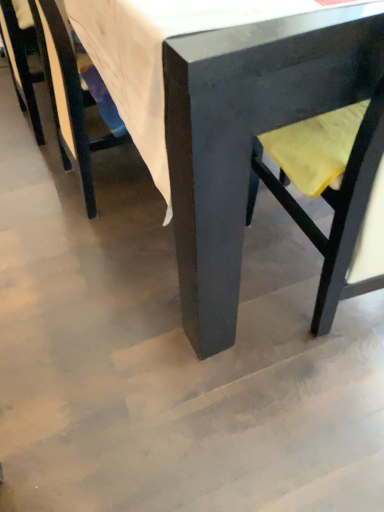
Image resolution: width=384 pixels, height=512 pixels. What do you see at coordinates (336, 195) in the screenshot? I see `yellow fabric swivel chair at right` at bounding box center [336, 195].

What do you see at coordinates (68, 97) in the screenshot?
I see `matte black chair at lower left, which is the second chair from right to left` at bounding box center [68, 97].

Where is `matte black chair at left, the 3th chair when ordered from right to left`? This screenshot has width=384, height=512. matte black chair at left, the 3th chair when ordered from right to left is located at coordinates (20, 67).

I want to click on yellow fabric swivel chair at right, so click(336, 195).

Looking at this image, is matte black chair at left, positioned as the first chair in left-to-right order, behind matte black chair at center, which is counted as the 3th chair, starting from the left?

That is True.

How different are the orientations of matte black chair at left, positioned as the first chair in left-to-right order, and matte black chair at center, which is counted as the 3th chair, starting from the left, in degrees?

They differ by 0.467 degrees in their facing directions.

In the scene shown: Can you confirm if matte black chair at left, positioned as the first chair in left-to-right order, is bigger than matte black chair at center, the 1th chair positioned from the right?

No, matte black chair at left, positioned as the first chair in left-to-right order, is not bigger than matte black chair at center, the 1th chair positioned from the right.

Are matte black chair at left, positioned as the first chair in left-to-right order, and matte black chair at center, the 1th chair positioned from the right, located far from each other?

Indeed, matte black chair at left, positioned as the first chair in left-to-right order, is not near matte black chair at center, the 1th chair positioned from the right.

In the image, there is a matte black chair at left, positioned as the first chair in left-to-right order. Identify the location of chair below it (from the image's perspective). This screenshot has width=384, height=512. click(68, 97).

Which object is thinner, matte black chair at left, the 3th chair when ordered from right to left, or matte black chair at lower left, which is the second chair in left-to-right order?

matte black chair at left, the 3th chair when ordered from right to left, is thinner.

Would you say matte black chair at left, the 3th chair when ordered from right to left, is a long distance from matte black chair at lower left, which is the second chair in left-to-right order?

No.

Are matte black chair at lower left, which is the second chair in left-to-right order, and matte black chair at left, the 3th chair when ordered from right to left, making contact?

matte black chair at lower left, which is the second chair in left-to-right order, is not next to matte black chair at left, the 3th chair when ordered from right to left, and they're not touching.

Considering the relative sizes of matte black chair at lower left, which is the second chair from right to left, and matte black chair at left, positioned as the first chair in left-to-right order, in the image provided, is matte black chair at lower left, which is the second chair from right to left, thinner than matte black chair at left, positioned as the first chair in left-to-right order,?

Incorrect, the width of matte black chair at lower left, which is the second chair from right to left, is not less than that of matte black chair at left, positioned as the first chair in left-to-right order.

Is matte black chair at lower left, which is the second chair from right to left, completely or partially outside of matte black chair at left, positioned as the first chair in left-to-right order?

Yes, matte black chair at lower left, which is the second chair from right to left, is outside of matte black chair at left, positioned as the first chair in left-to-right order.

Is matte black chair at lower left, which is the second chair in left-to-right order, inside or outside of matte black chair at center, which is counted as the 3th chair, starting from the left?

matte black chair at lower left, which is the second chair in left-to-right order, is enclosed within matte black chair at center, which is counted as the 3th chair, starting from the left.

Is matte black chair at lower left, which is the second chair from right to left, looking in the opposite direction of matte black chair at center, which is counted as the 3th chair, starting from the left?

Absolutely, matte black chair at lower left, which is the second chair from right to left, is directed away from matte black chair at center, which is counted as the 3th chair, starting from the left.

From the image's perspective, is matte black chair at lower left, which is the second chair in left-to-right order, on matte black chair at center, which is counted as the 3th chair, starting from the left?

No, from the image's perspective, matte black chair at lower left, which is the second chair in left-to-right order, is not on top of matte black chair at center, which is counted as the 3th chair, starting from the left.

Which object is further away from the camera taking this photo, yellow fabric swivel chair at right or matte black chair at left, positioned as the first chair in left-to-right order?

matte black chair at left, positioned as the first chair in left-to-right order, is further from the camera.

Does point (298, 206) come behind point (33, 111)?

No, (298, 206) is in front of (33, 111).

From a real-world perspective, is yellow fabric swivel chair at right physically below matte black chair at left, the 3th chair when ordered from right to left?

No, from a real-world perspective, yellow fabric swivel chair at right is not below matte black chair at left, the 3th chair when ordered from right to left.

Measure the distance between yellow fabric swivel chair at right and matte black chair at left, the 3th chair when ordered from right to left.

The distance of yellow fabric swivel chair at right from matte black chair at left, the 3th chair when ordered from right to left, is 1.20 meters.

From a real-world perspective, relative to yellow fabric swivel chair at right, is matte black chair at left, the 3th chair when ordered from right to left, vertically above or below?

Clearly, from a real-world perspective, matte black chair at left, the 3th chair when ordered from right to left, is below yellow fabric swivel chair at right.

Considering the sizes of objects matte black chair at left, the 3th chair when ordered from right to left, and yellow fabric swivel chair at right in the image provided, who is shorter, matte black chair at left, the 3th chair when ordered from right to left, or yellow fabric swivel chair at right?

matte black chair at left, the 3th chair when ordered from right to left.

Considering the sizes of objects matte black chair at left, positioned as the first chair in left-to-right order, and yellow fabric swivel chair at right in the image provided, who is smaller, matte black chair at left, positioned as the first chair in left-to-right order, or yellow fabric swivel chair at right?

matte black chair at left, positioned as the first chair in left-to-right order.

Looking at their sizes, would you say matte black chair at center, which is counted as the 3th chair, starting from the left, is wider or thinner than matte black chair at lower left, which is the second chair from right to left?

Clearly, matte black chair at center, which is counted as the 3th chair, starting from the left, has more width compared to matte black chair at lower left, which is the second chair from right to left.

Can you tell me how much matte black chair at center, which is counted as the 3th chair, starting from the left, and matte black chair at lower left, which is the second chair in left-to-right order, differ in facing direction?

The angular difference between matte black chair at center, which is counted as the 3th chair, starting from the left, and matte black chair at lower left, which is the second chair in left-to-right order, is 0.467 degrees.

Is matte black chair at center, which is counted as the 3th chair, starting from the left, positioned with its back to matte black chair at lower left, which is the second chair in left-to-right order?

Absolutely, matte black chair at center, which is counted as the 3th chair, starting from the left, is directed away from matte black chair at lower left, which is the second chair in left-to-right order.

Which is behind, matte black chair at center, the 1th chair positioned from the right, or matte black chair at lower left, which is the second chair from right to left?

matte black chair at lower left, which is the second chair from right to left, is further from the camera.

The height and width of the screenshot is (512, 384). I want to click on the 2nd chair counting from the left of the matte black chair at center, the 1th chair positioned from the right, so click(20, 67).

The width and height of the screenshot is (384, 512). What are the coordinates of `chair below the matte black chair at left, positioned as the first chair in left-to-right order (from the image's perspective)` in the screenshot? It's located at (68, 97).

Considering their positions, is matte black chair at center, which is counted as the 3th chair, starting from the left, positioned closer to matte black chair at lower left, which is the second chair in left-to-right order, than yellow fabric swivel chair at right?

matte black chair at center, which is counted as the 3th chair, starting from the left.

Looking at the image, which one is located closer to matte black chair at lower left, which is the second chair from right to left, yellow fabric swivel chair at right or matte black chair at center, the 1th chair positioned from the right?

matte black chair at center, the 1th chair positioned from the right.

When comparing their distances from matte black chair at center, the 1th chair positioned from the right, does yellow fabric swivel chair at right or matte black chair at left, the 3th chair when ordered from right to left, seem further?

matte black chair at left, the 3th chair when ordered from right to left, is further to matte black chair at center, the 1th chair positioned from the right.

When comparing their distances from matte black chair at lower left, which is the second chair in left-to-right order, does matte black chair at left, positioned as the first chair in left-to-right order, or yellow fabric swivel chair at right seem closer?

Among the two, matte black chair at left, positioned as the first chair in left-to-right order, is located nearer to matte black chair at lower left, which is the second chair in left-to-right order.

From the picture: Which object lies nearer to the anchor point yellow fabric swivel chair at right, matte black chair at center, which is counted as the 3th chair, starting from the left, or matte black chair at left, positioned as the first chair in left-to-right order?

The object closer to yellow fabric swivel chair at right is matte black chair at center, which is counted as the 3th chair, starting from the left.

Estimate the real-world distances between objects in this image. Which object is closer to matte black chair at lower left, which is the second chair in left-to-right order, matte black chair at center, the 1th chair positioned from the right, or matte black chair at left, positioned as the first chair in left-to-right order?

A: Based on the image, matte black chair at left, positioned as the first chair in left-to-right order, appears to be nearer to matte black chair at lower left, which is the second chair in left-to-right order.

From the picture: Estimate the real-world distances between objects in this image. Which object is further from matte black chair at center, the 1th chair positioned from the right, matte black chair at lower left, which is the second chair in left-to-right order, or yellow fabric swivel chair at right?

matte black chair at lower left, which is the second chair in left-to-right order, is positioned further to the anchor matte black chair at center, the 1th chair positioned from the right.

Looking at the image, which one is located further to yellow fabric swivel chair at right, matte black chair at lower left, which is the second chair from right to left, or matte black chair at center, which is counted as the 3th chair, starting from the left?

Among the two, matte black chair at lower left, which is the second chair from right to left, is located further to yellow fabric swivel chair at right.

What are the coordinates of `chair located between matte black chair at lower left, which is the second chair in left-to-right order, and yellow fabric swivel chair at right in the left-right direction` in the screenshot? It's located at (247, 135).

Identify the location of chair between matte black chair at center, the 1th chair positioned from the right, and matte black chair at left, the 3th chair when ordered from right to left, from front to back. (68, 97).